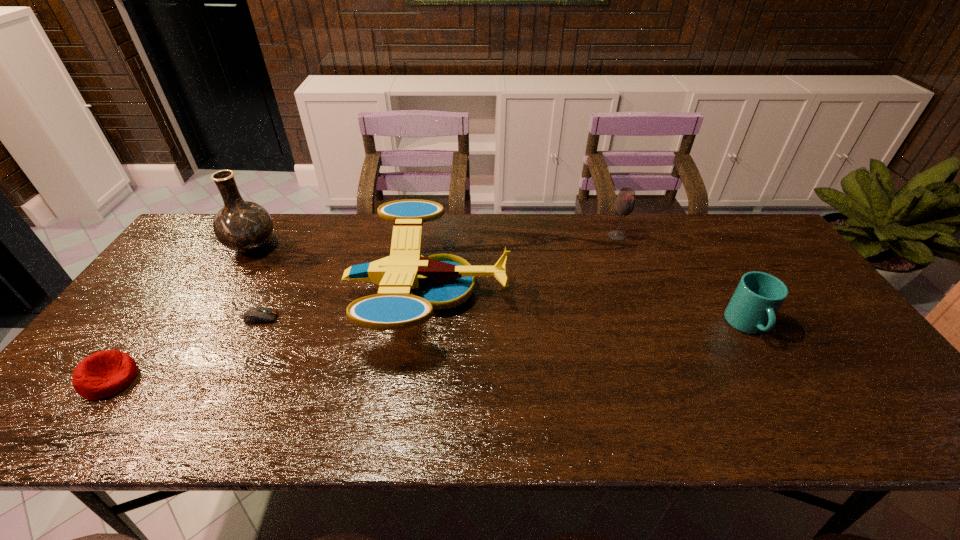
Where is `empty location between the rightmost object and the computer equipment`? Image resolution: width=960 pixels, height=540 pixels. empty location between the rightmost object and the computer equipment is located at coordinates (504, 322).

Where is `free point between the glass drink container and the tallest object`? free point between the glass drink container and the tallest object is located at coordinates (435, 241).

Where is `empty space between the second shortest object and the shortest object`? This screenshot has height=540, width=960. empty space between the second shortest object and the shortest object is located at coordinates (185, 349).

What are the coordinates of `vacant region between the computer equipment and the tallest object` in the screenshot? It's located at (256, 282).

You are a GUI agent. You are given a task and a screenshot of the screen. Output one action in this format:
    pyautogui.click(x=<x>, y=<y>)
    Task: Click on the vacant region between the fourth object from left to right and the fifth tallest object
    This screenshot has height=540, width=960.
    Given the screenshot: What is the action you would take?
    pyautogui.click(x=269, y=335)

At what (x,y) coordinates should I click in order to perform the action: click on vacant region between the second object from right to left and the rightmost object. Please return your answer as a coordinate pair (x, y). The width and height of the screenshot is (960, 540). Looking at the image, I should click on (682, 281).

The image size is (960, 540). Identify the location of the fourth closest object to the shortest object. (624, 204).

Point out which object is positioned as the fifth nearest to the rightmost object. Please provide its 2D coordinates. Your answer should be formatted as a tuple, i.e. [(x, y)], where the tuple contains the x and y coordinates of a point satisfying the conditions above.

[(103, 374)]

I want to click on free location that satisfies the following two spatial constraints: 1. on the front side of the glass drink container; 2. on the seat area of the beanbag, so (672, 380).

The height and width of the screenshot is (540, 960). What are the coordinates of `free spot that satisfies the following two spatial constraints: 1. on the back side of the vase; 2. on the right side of the glass drink container` in the screenshot? It's located at (259, 236).